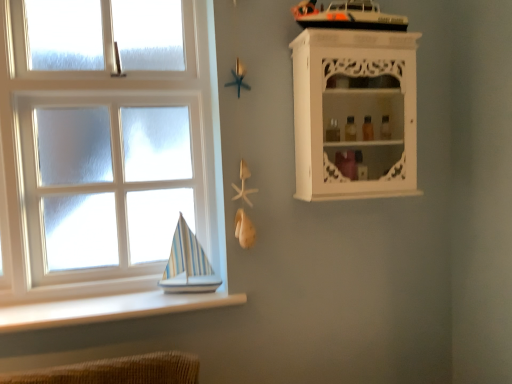
Question: Considering the relative positions of white smooth ledge at lower left and white carved wood cabinet at upper right in the image provided, is white smooth ledge at lower left to the right of white carved wood cabinet at upper right from the viewer's perspective?

Choices:
 (A) yes
 (B) no

Answer: (B)

Question: Does white smooth ledge at lower left turn towards white carved wood cabinet at upper right?

Choices:
 (A) yes
 (B) no

Answer: (B)

Question: Is white smooth ledge at lower left directly adjacent to white carved wood cabinet at upper right?

Choices:
 (A) no
 (B) yes

Answer: (A)

Question: Is the position of white smooth ledge at lower left less distant than that of white carved wood cabinet at upper right?

Choices:
 (A) yes
 (B) no

Answer: (A)

Question: From a real-world perspective, is white smooth ledge at lower left positioned under white carved wood cabinet at upper right based on gravity?

Choices:
 (A) no
 (B) yes

Answer: (B)

Question: Is point (414, 41) closer or farther from the camera than point (90, 279)?

Choices:
 (A) closer
 (B) farther

Answer: (A)

Question: In the image, is white carved wood cabinet at upper right on the left side or the right side of white wooden window at lower left?

Choices:
 (A) right
 (B) left

Answer: (A)

Question: Is white carved wood cabinet at upper right inside or outside of white wooden window at lower left?

Choices:
 (A) outside
 (B) inside

Answer: (A)

Question: From the image's perspective, is white carved wood cabinet at upper right above or below white wooden window at lower left?

Choices:
 (A) above
 (B) below

Answer: (A)

Question: Is white carved wood cabinet at upper right in front of or behind white smooth ledge at lower left in the image?

Choices:
 (A) front
 (B) behind

Answer: (B)

Question: In the image, is white carved wood cabinet at upper right on the left side or the right side of white smooth ledge at lower left?

Choices:
 (A) right
 (B) left

Answer: (A)

Question: Is white carved wood cabinet at upper right wider or thinner than white smooth ledge at lower left?

Choices:
 (A) wide
 (B) thin

Answer: (B)

Question: Is white carved wood cabinet at upper right taller or shorter than white smooth ledge at lower left?

Choices:
 (A) short
 (B) tall

Answer: (B)

Question: From a real-world perspective, relative to white carved wood cabinet at upper right, is white smooth ledge at lower left vertically above or below?

Choices:
 (A) below
 (B) above

Answer: (A)

Question: Would you say white smooth ledge at lower left is to the left or to the right of white carved wood cabinet at upper right in the picture?

Choices:
 (A) right
 (B) left

Answer: (B)